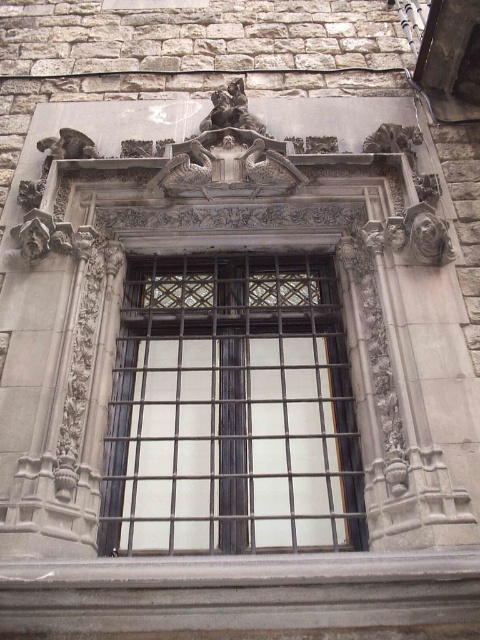
You are standing in front of the building and want to take a photo of the metallic grid window at center without the gray stone gargoyle at upper center appearing in the frame. Is this possible given their positions?

The metallic grid window at center is in front of the gray stone gargoyle at upper center, so you cannot take a photo of the metallic grid window at center without the gray stone gargoyle at upper center appearing in the frame because the gargoyle is behind the window and would be obscured.

You are an architect examining the building facade. You need to determine if the metallic grid window at center can fit vertically within the space currently occupied by the gray stone gargoyle at upper center. Based on their heights, what would you conclude?

The metallic grid window at center has a greater height compared to the gray stone gargoyle at upper center. Therefore, it cannot fit vertically within the gargoyle space as it is taller.

You are an architect analyzing the building facade. The metallic grid window at center and the polished bronze statue at upper center are key elements. Based on their sizes, which one would require more vertical space when designing a replica?

The metallic grid window at center has a greater height compared to the polished bronze statue at upper center, so it would require more vertical space when designing a replica.